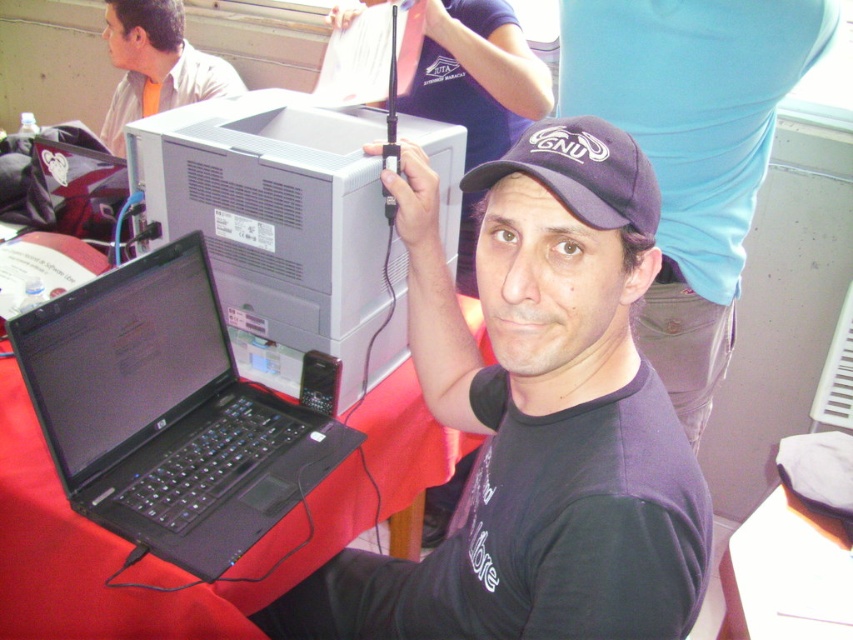
Is point (281, 326) more distant than point (170, 10)?

No, it is not.

Who is lower down, gray matte desktop computer at upper center or light beige shirt at upper left?

Positioned lower is gray matte desktop computer at upper center.

This screenshot has width=853, height=640. Find the location of `gray matte desktop computer at upper center`. gray matte desktop computer at upper center is located at coordinates (280, 228).

From the picture: Which is above, matte black cap at upper center or dark blue fabric baseball cap at center?

Positioned higher is dark blue fabric baseball cap at center.

Does matte black cap at upper center come in front of dark blue fabric baseball cap at center?

No.

What do you see at coordinates (537, 419) in the screenshot?
I see `matte black cap at upper center` at bounding box center [537, 419].

The width and height of the screenshot is (853, 640). In order to click on matte black cap at upper center in this screenshot , I will do `click(537, 419)`.

Could you measure the distance between black matte laptop at lower left and gray matte desktop computer at upper center?

The distance of black matte laptop at lower left from gray matte desktop computer at upper center is 8.46 inches.

Is point (125, 394) positioned behind point (160, 216)?

No, (125, 394) is closer to viewer.

Image resolution: width=853 pixels, height=640 pixels. Find the location of `black matte laptop at lower left`. black matte laptop at lower left is located at coordinates (166, 413).